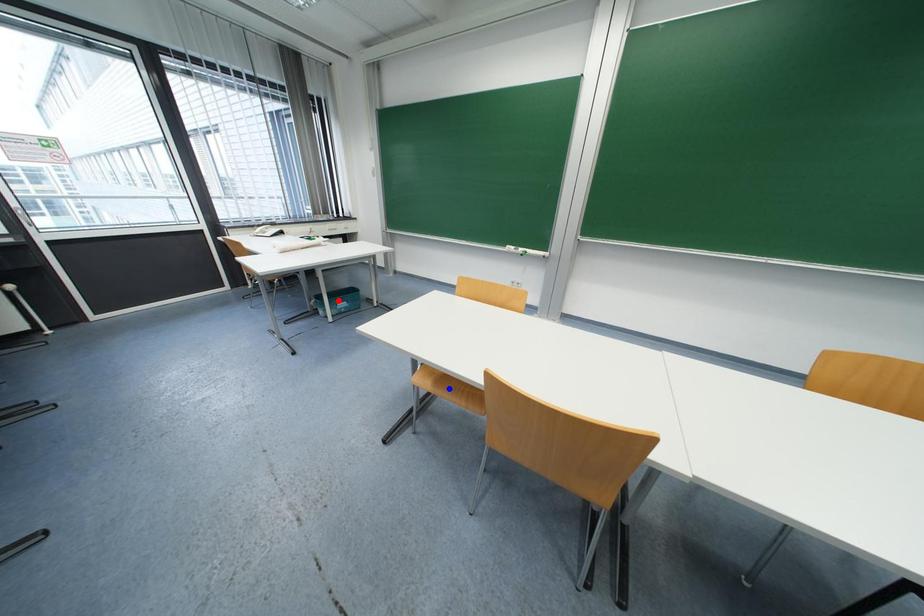
Question: Which of the two points in the image is closer to the camera?

Choices:
 (A) Blue point is closer.
 (B) Red point is closer.

Answer: (A)